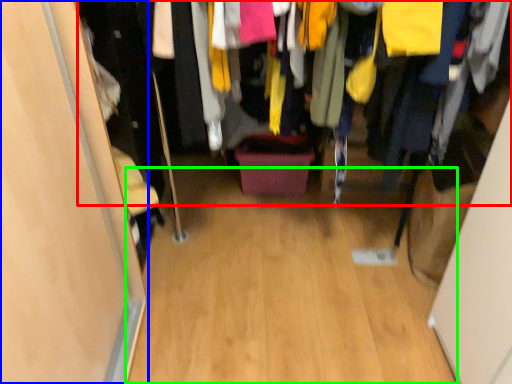
Question: Based on their relative distances, which object is nearer to closet (highlighted by a red box)? Choose from door (highlighted by a blue box) and plain (highlighted by a green box).

Choices:
 (A) door
 (B) plain

Answer: (A)